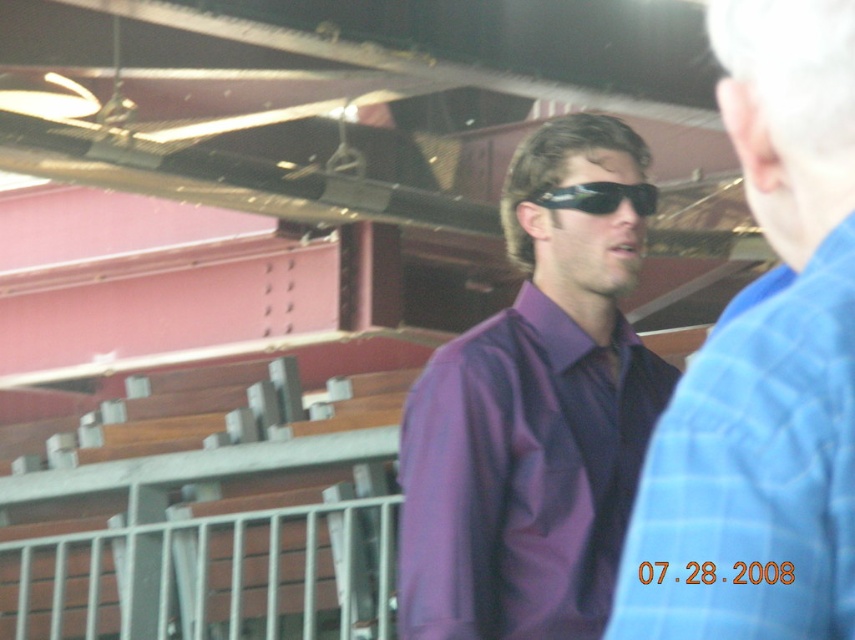
You are standing in the stadium and see the purple smooth shirt at center and the sunglasses at center. Which object is nearer to you?

The purple smooth shirt at center is closer to the viewer than the sunglasses at center.

You are standing at the entrance of the stadium and see the purple shiny shirt at center and the sunglasses at center. Which object is nearer to you?

The purple shiny shirt at center is closer to the viewer than the sunglasses at center.